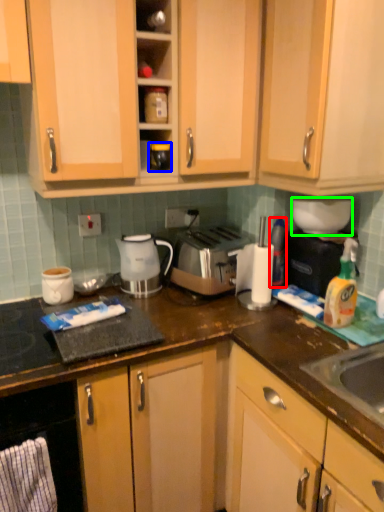
Question: Which is nearer to the bottle (highlighted by a red box)? appliance (highlighted by a blue box) or appliance (highlighted by a green box).

Choices:
 (A) appliance
 (B) appliance

Answer: (B)